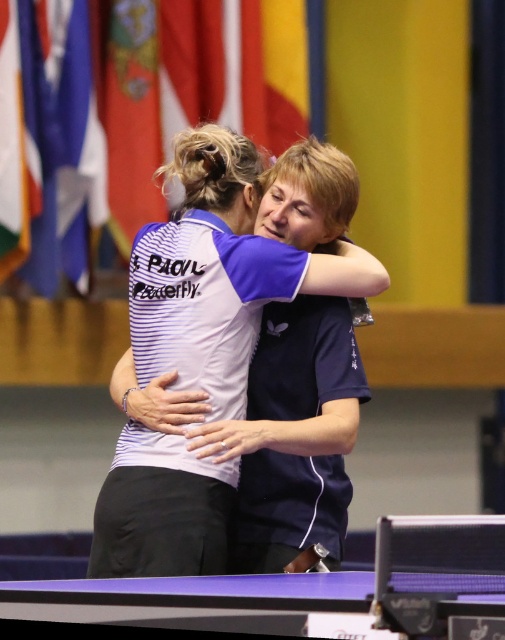
Question: Does white striped shirt at center have a larger size compared to purple glossy table tennis table at lower center?

Choices:
 (A) yes
 (B) no

Answer: (A)

Question: Does white striped shirt at center have a smaller size compared to purple glossy table tennis table at lower center?

Choices:
 (A) no
 (B) yes

Answer: (A)

Question: Which of the following is the farthest from the observer?

Choices:
 (A) white striped shirt at center
 (B) purple glossy table tennis table at lower center

Answer: (A)

Question: Is white striped shirt at center closer to camera compared to purple glossy table tennis table at lower center?

Choices:
 (A) yes
 (B) no

Answer: (B)

Question: Which point is farther to the camera?

Choices:
 (A) (206, 248)
 (B) (498, 611)

Answer: (A)